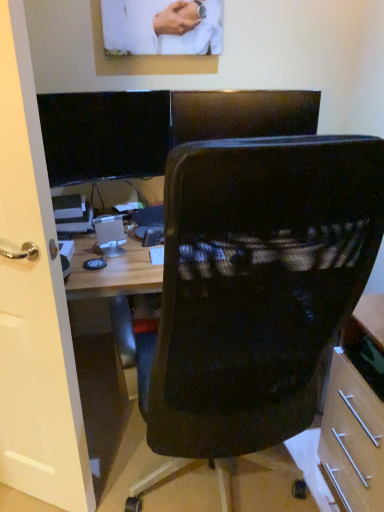
Question: Considering the relative positions of black glossy monitor at upper left and white glossy door at left in the image provided, is black glossy monitor at upper left in front of white glossy door at left?

Choices:
 (A) no
 (B) yes

Answer: (A)

Question: Considering the relative sizes of black glossy monitor at upper left and white glossy door at left in the image provided, is black glossy monitor at upper left smaller than white glossy door at left?

Choices:
 (A) yes
 (B) no

Answer: (A)

Question: Is black glossy monitor at upper left positioned with its back to white glossy door at left?

Choices:
 (A) no
 (B) yes

Answer: (A)

Question: Does black glossy monitor at upper left lie behind white glossy door at left?

Choices:
 (A) yes
 (B) no

Answer: (A)

Question: Does black glossy monitor at upper left have a larger size compared to white glossy door at left?

Choices:
 (A) no
 (B) yes

Answer: (A)

Question: Is black glossy monitor at upper left thinner than white glossy door at left?

Choices:
 (A) yes
 (B) no

Answer: (A)

Question: Is black mesh chair at center wider than black glossy monitor at upper left?

Choices:
 (A) yes
 (B) no

Answer: (A)

Question: From the image's perspective, is black mesh chair at center on top of black glossy monitor at upper left?

Choices:
 (A) yes
 (B) no

Answer: (B)

Question: Is black mesh chair at center positioned behind black glossy monitor at upper left?

Choices:
 (A) no
 (B) yes

Answer: (A)

Question: Does black mesh chair at center have a larger size compared to black glossy monitor at upper left?

Choices:
 (A) yes
 (B) no

Answer: (A)

Question: Is black mesh chair at center to the right of black glossy monitor at upper left from the viewer's perspective?

Choices:
 (A) no
 (B) yes

Answer: (B)

Question: Is black mesh chair at center located outside black glossy monitor at upper left?

Choices:
 (A) yes
 (B) no

Answer: (A)

Question: Considering the relative sizes of white glossy door at left and black mesh chair at center in the image provided, is white glossy door at left wider than black mesh chair at center?

Choices:
 (A) yes
 (B) no

Answer: (B)